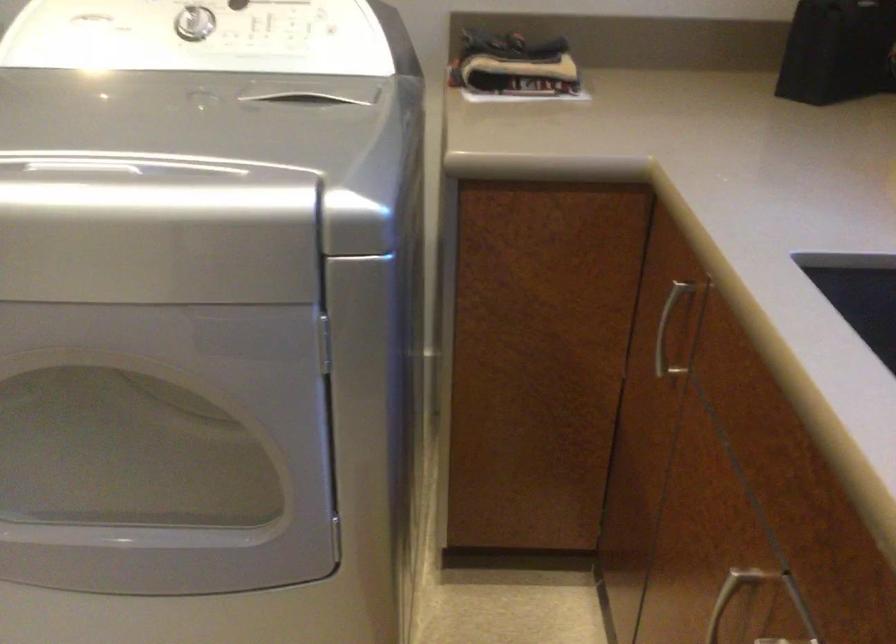
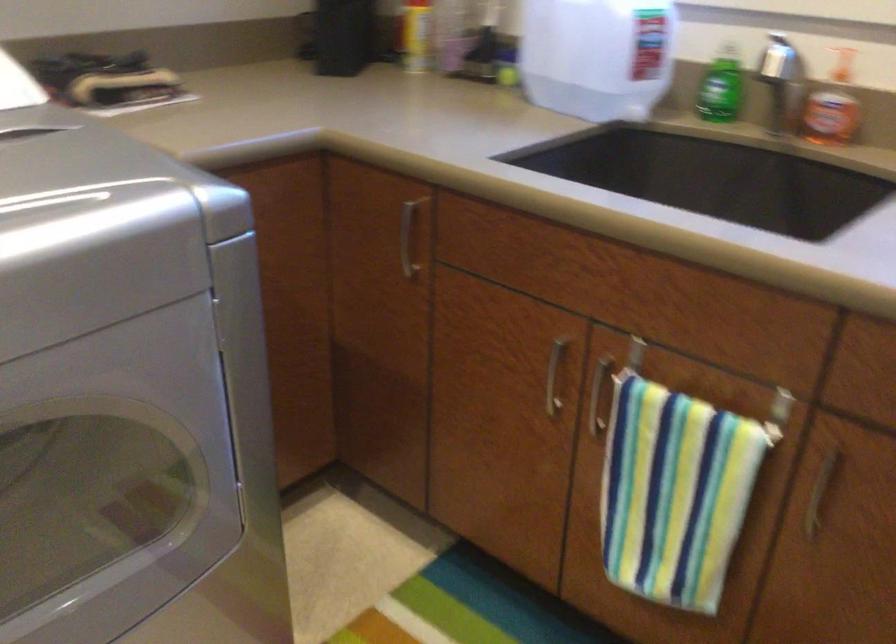
Where in the second image is the point corresponding to pixel 682 327 from the first image?

(407, 238)